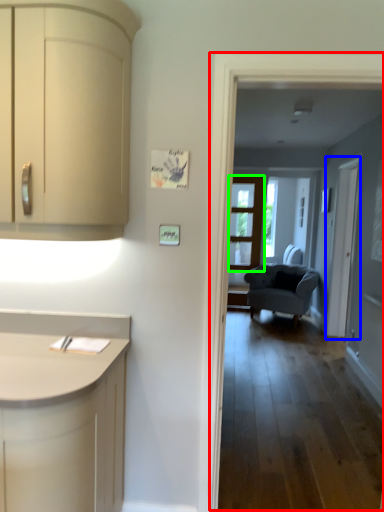
Question: Estimate the real-world distances between objects in this image. Which object is closer to corridor (highlighted by a red box), screen door (highlighted by a blue box) or door (highlighted by a green box)?

Choices:
 (A) screen door
 (B) door

Answer: (A)